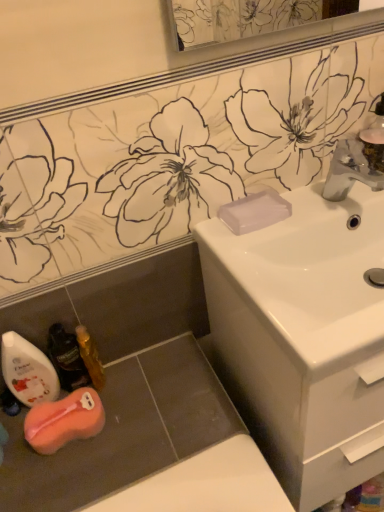
At what (x,y) coordinates should I click in order to perform the action: click on free point to the left of satin nickel faucet at upper right. Please return your answer as a coordinate pair (x, y). This screenshot has width=384, height=512. Looking at the image, I should click on (283, 216).